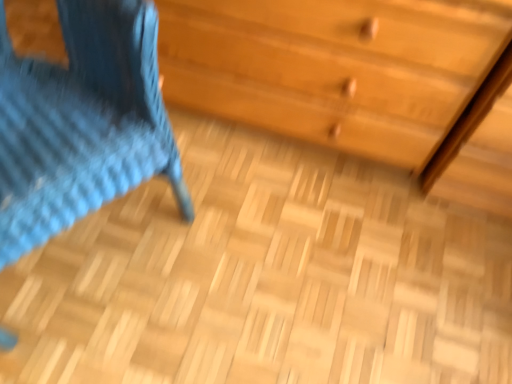
Measure the distance between point (72, 127) and camera.

The distance of point (72, 127) from camera is 30.43 inches.

Describe the element at coordinates (82, 122) in the screenshot. I see `blue knitted chair at left` at that location.

What is the approximate width of blue knitted chair at left?

The width of blue knitted chair at left is 23.87 inches.

You are a GUI agent. You are given a task and a screenshot of the screen. Output one action in this format:
    pyautogui.click(x=<x>, y=<y>)
    Task: Click on the blue knitted chair at left
    
    Given the screenshot: What is the action you would take?
    pyautogui.click(x=82, y=122)

The image size is (512, 384). What do you see at coordinates (333, 67) in the screenshot?
I see `wooden chest of drawers at upper right` at bounding box center [333, 67].

Locate an element on the screen. The width and height of the screenshot is (512, 384). wooden chest of drawers at upper right is located at coordinates (333, 67).

Locate an element on the screen. This screenshot has height=384, width=512. blue knitted chair at left is located at coordinates pos(82,122).

Does wooden chest of drawers at upper right appear on the left side of blue knitted chair at left?

Incorrect, wooden chest of drawers at upper right is not on the left side of blue knitted chair at left.

Which is behind, wooden chest of drawers at upper right or blue knitted chair at left?

wooden chest of drawers at upper right is more distant.

Is point (349, 131) positioned in front of point (25, 119)?

No, (349, 131) is behind (25, 119).

From the image's perspective, is wooden chest of drawers at upper right positioned above or below blue knitted chair at left?

Clearly, from the image's perspective, wooden chest of drawers at upper right is above blue knitted chair at left.

From a real-world perspective, which object stands above the other?

blue knitted chair at left is physically above.

Considering the relative sizes of wooden chest of drawers at upper right and blue knitted chair at left in the image provided, is wooden chest of drawers at upper right wider than blue knitted chair at left?

Incorrect, the width of wooden chest of drawers at upper right does not surpass that of blue knitted chair at left.

Between wooden chest of drawers at upper right and blue knitted chair at left, which one has less height?

With less height is wooden chest of drawers at upper right.

Is wooden chest of drawers at upper right smaller than blue knitted chair at left?

Incorrect, wooden chest of drawers at upper right is not smaller in size than blue knitted chair at left.

Would you say wooden chest of drawers at upper right is inside or outside blue knitted chair at left?

wooden chest of drawers at upper right is not inside blue knitted chair at left, it's outside.

Is wooden chest of drawers at upper right placed right next to blue knitted chair at left?

No, wooden chest of drawers at upper right is not next to blue knitted chair at left.

Is wooden chest of drawers at upper right oriented away from blue knitted chair at left?

wooden chest of drawers at upper right does not have its back to blue knitted chair at left.

How many degrees apart are the facing directions of wooden chest of drawers at upper right and blue knitted chair at left?

61.4 degrees separate the facing orientations of wooden chest of drawers at upper right and blue knitted chair at left.

Measure the distance from wooden chest of drawers at upper right to blue knitted chair at left.

wooden chest of drawers at upper right and blue knitted chair at left are 16.03 inches apart.

This screenshot has width=512, height=384. I want to click on chest of drawers below the blue knitted chair at left (from a real-world perspective), so click(333, 67).

Considering the positions of objects blue knitted chair at left and wooden chest of drawers at upper right in the image provided, who is more to the right, blue knitted chair at left or wooden chest of drawers at upper right?

Positioned to the right is wooden chest of drawers at upper right.

Relative to wooden chest of drawers at upper right, is blue knitted chair at left in front or behind?

blue knitted chair at left is positioned closer to the viewer than wooden chest of drawers at upper right.

Considering the points (77, 63) and (362, 153), which point is behind, point (77, 63) or point (362, 153)?

Point (362, 153)

From the image's perspective, who appears lower, blue knitted chair at left or wooden chest of drawers at upper right?

blue knitted chair at left.

From a real-world perspective, is blue knitted chair at left under wooden chest of drawers at upper right?

Actually, blue knitted chair at left is physically above wooden chest of drawers at upper right in the real world.

In terms of width, does blue knitted chair at left look wider or thinner when compared to wooden chest of drawers at upper right?

blue knitted chair at left is wider than wooden chest of drawers at upper right.

Which of these two, blue knitted chair at left or wooden chest of drawers at upper right, stands shorter?

With less height is wooden chest of drawers at upper right.

Is blue knitted chair at left bigger or smaller than wooden chest of drawers at upper right?

blue knitted chair at left is smaller than wooden chest of drawers at upper right.

Would you say blue knitted chair at left is inside or outside wooden chest of drawers at upper right?

blue knitted chair at left exists outside the volume of wooden chest of drawers at upper right.

Is blue knitted chair at left far away from wooden chest of drawers at upper right?

No, there isn't a large distance between blue knitted chair at left and wooden chest of drawers at upper right.

Is blue knitted chair at left oriented towards wooden chest of drawers at upper right?

No, blue knitted chair at left is not facing towards wooden chest of drawers at upper right.

How many degrees apart are the facing directions of blue knitted chair at left and wooden chest of drawers at upper right?

61.4 degrees.

There is a wooden chest of drawers at upper right. At what (x,y) coordinates should I click in order to perform the action: click on furniture above it (from a real-world perspective). Please return your answer as a coordinate pair (x, y). The height and width of the screenshot is (384, 512). Looking at the image, I should click on (82, 122).

Image resolution: width=512 pixels, height=384 pixels. Identify the location of furniture in front of the wooden chest of drawers at upper right. (82, 122).

The height and width of the screenshot is (384, 512). In order to click on furniture below the wooden chest of drawers at upper right (from the image's perspective) in this screenshot , I will do `click(82, 122)`.